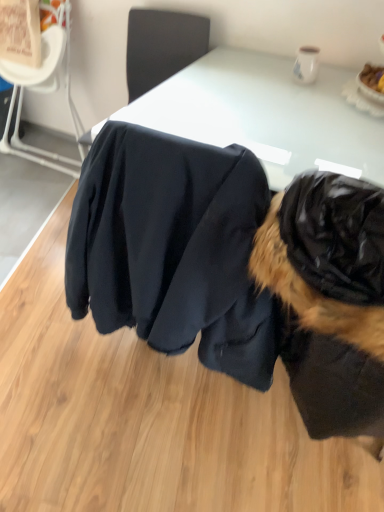
Image resolution: width=384 pixels, height=512 pixels. Describe the element at coordinates (329, 298) in the screenshot. I see `black fur coat at right` at that location.

Image resolution: width=384 pixels, height=512 pixels. What do you see at coordinates (161, 46) in the screenshot? I see `black fabric chair at upper center, marked as the 1th chair in a right-to-left arrangement` at bounding box center [161, 46].

You are a GUI agent. You are given a task and a screenshot of the screen. Output one action in this format:
    pyautogui.click(x=<x>, y=<y>)
    Task: Click on the black fabric chair at upper left, the 1th chair from the left
    The image size is (384, 512).
    Given the screenshot: What is the action you would take?
    pyautogui.click(x=43, y=91)

In order to face white glossy table at center, should I rotate leftwards or rightwards?

A 9.609 degree turn to the right will do.

Find the location of a particular element. This screenshot has width=384, height=512. black fur coat at right is located at coordinates (329, 298).

Which object is positioned more to the right, black fabric chair at upper left, the 1th chair from the left, or white glossy table at center?

A: From the viewer's perspective, white glossy table at center appears more on the right side.

From the image's perspective, which is below, black fabric chair at upper left, the 1th chair from the left, or white glossy table at center?

From the image's view, white glossy table at center is below.

How different are the orientations of black fabric chair at upper left, the second chair when ordered from right to left, and white glossy table at center in degrees?

3.89e-05 degrees separate the facing orientations of black fabric chair at upper left, the second chair when ordered from right to left, and white glossy table at center.

Is black fabric chair at upper left, the second chair when ordered from right to left, aimed at matte black jacket at center?

No, black fabric chair at upper left, the second chair when ordered from right to left, is not oriented towards matte black jacket at center.

Considering the relative sizes of black fabric chair at upper left, the 1th chair from the left, and matte black jacket at center in the image provided, is black fabric chair at upper left, the 1th chair from the left, smaller than matte black jacket at center?

No.

From the image's perspective, is black fabric chair at upper left, the second chair when ordered from right to left, above or below matte black jacket at center?

black fabric chair at upper left, the second chair when ordered from right to left, is situated higher than matte black jacket at center in the image.

Looking at this image, between black fabric chair at upper left, the 1th chair from the left, and matte black jacket at center, which one appears on the left side from the viewer's perspective?

black fabric chair at upper left, the 1th chair from the left, is more to the left.

Looking at this image, between white glossy table at center and black fur coat at right, which one has larger size?

Bigger between the two is white glossy table at center.

Considering the sizes of objects white glossy table at center and black fur coat at right in the image provided, who is wider, white glossy table at center or black fur coat at right?

With larger width is white glossy table at center.

Can you see white glossy table at center touching black fur coat at right?

No, white glossy table at center is not beside black fur coat at right.

Can you confirm if white glossy table at center is taller than black fur coat at right?

No.

Can you tell me how much matte black jacket at center and black fur coat at right differ in facing direction?

5.17e-05 degrees separate the facing orientations of matte black jacket at center and black fur coat at right.

Is matte black jacket at center aimed at black fur coat at right?

No.

Is matte black jacket at center shorter than black fur coat at right?

Yes.

Find the location of a particular element. The width and height of the screenshot is (384, 512). dog above the matte black jacket at center (from a real-world perspective) is located at coordinates tap(329, 298).

From a real-world perspective, is matte black jacket at center below black fabric chair at upper left, the second chair when ordered from right to left?

Indeed, from a real-world perspective, matte black jacket at center is positioned beneath black fabric chair at upper left, the second chair when ordered from right to left.

Who is shorter, matte black jacket at center or black fabric chair at upper left, the second chair when ordered from right to left?

With less height is matte black jacket at center.

Which is behind, point (146, 165) or point (53, 28)?

The point (53, 28) is farther from the camera.

Is matte black jacket at center far from black fabric chair at upper left, the second chair when ordered from right to left?

Absolutely, matte black jacket at center is distant from black fabric chair at upper left, the second chair when ordered from right to left.

Does black fabric chair at upper center, which is counted as the second chair, starting from the left, have a larger size compared to black fur coat at right?

Actually, black fabric chair at upper center, which is counted as the second chair, starting from the left, might be smaller than black fur coat at right.

Find the location of a particular element. This screenshot has height=512, width=384. dog below the black fabric chair at upper center, which is counted as the second chair, starting from the left (from the image's perspective) is located at coordinates (329, 298).

Do you think black fabric chair at upper center, which is counted as the second chair, starting from the left, is within black fur coat at right, or outside of it?

black fabric chair at upper center, which is counted as the second chair, starting from the left, is outside black fur coat at right.

Locate an element on the screen. the 1st chair to the left of the white glossy table at center, counting from the anchor's position is located at coordinates (161, 46).

Is black fabric chair at upper center, which is counted as the second chair, starting from the left, oriented away from white glossy table at center?

No, black fabric chair at upper center, which is counted as the second chair, starting from the left, is not facing the opposite direction of white glossy table at center.

Is black fabric chair at upper center, which is counted as the second chair, starting from the left, in contact with white glossy table at center?

No, black fabric chair at upper center, which is counted as the second chair, starting from the left, is not touching white glossy table at center.

From a real-world perspective, is black fabric chair at upper center, marked as the 1th chair in a right-to-left arrangement, physically located above or below white glossy table at center?

black fabric chair at upper center, marked as the 1th chair in a right-to-left arrangement, is above white glossy table at center.

You are a GUI agent. You are given a task and a screenshot of the screen. Output one action in this format:
    pyautogui.click(x=<x>, y=<y>)
    Task: Click on the table positioned vertically above the black fabric chair at upper left, the second chair when ordered from right to left (from a real-world perspective)
    
    Given the screenshot: What is the action you would take?
    pyautogui.click(x=265, y=115)

Locate an element on the screen. The image size is (384, 512). clothing beneath the black fabric chair at upper left, the 1th chair from the left (from a real-world perspective) is located at coordinates (173, 249).

When comparing their distances from black fur coat at right, does black fabric chair at upper center, marked as the 1th chair in a right-to-left arrangement, or matte black jacket at center seem further?

The object further to black fur coat at right is black fabric chair at upper center, marked as the 1th chair in a right-to-left arrangement.

Estimate the real-world distances between objects in this image. Which object is closer to white glossy table at center, matte black jacket at center or black fabric chair at upper center, marked as the 1th chair in a right-to-left arrangement?

Among the two, matte black jacket at center is located nearer to white glossy table at center.

Based on the photo, based on their spatial positions, is matte black jacket at center or black fabric chair at upper left, the 1th chair from the left, further from black fabric chair at upper center, marked as the 1th chair in a right-to-left arrangement?

matte black jacket at center is positioned further to the anchor black fabric chair at upper center, marked as the 1th chair in a right-to-left arrangement.

Estimate the real-world distances between objects in this image. Which object is further from black fabric chair at upper center, which is counted as the second chair, starting from the left, black fabric chair at upper left, the second chair when ordered from right to left, or matte black jacket at center?

matte black jacket at center is further to black fabric chair at upper center, which is counted as the second chair, starting from the left.

In the scene shown: Estimate the real-world distances between objects in this image. Which object is closer to matte black jacket at center, black fur coat at right or white glossy table at center?

black fur coat at right is positioned closer to the anchor matte black jacket at center.

When comparing their distances from black fabric chair at upper left, the 1th chair from the left, does white glossy table at center or black fabric chair at upper center, marked as the 1th chair in a right-to-left arrangement, seem further?

white glossy table at center.

Based on the photo, based on their spatial positions, is black fabric chair at upper center, which is counted as the second chair, starting from the left, or black fabric chair at upper left, the 1th chair from the left, further from black fur coat at right?

Among the two, black fabric chair at upper left, the 1th chair from the left, is located further to black fur coat at right.

Looking at the image, which one is located closer to black fabric chair at upper center, marked as the 1th chair in a right-to-left arrangement, black fur coat at right or white glossy table at center?

Among the two, white glossy table at center is located nearer to black fabric chair at upper center, marked as the 1th chair in a right-to-left arrangement.

The width and height of the screenshot is (384, 512). Identify the location of chair situated between black fabric chair at upper left, the second chair when ordered from right to left, and matte black jacket at center from left to right. [161, 46].

The height and width of the screenshot is (512, 384). In order to click on table between black fabric chair at upper center, marked as the 1th chair in a right-to-left arrangement, and matte black jacket at center vertically in this screenshot , I will do `click(265, 115)`.

Where is `table between matte black jacket at center and black fur coat at right from left to right`? This screenshot has width=384, height=512. table between matte black jacket at center and black fur coat at right from left to right is located at coordinates (265, 115).

Where is `table between black fabric chair at upper center, marked as the 1th chair in a right-to-left arrangement, and black fur coat at right from top to bottom`? This screenshot has height=512, width=384. table between black fabric chair at upper center, marked as the 1th chair in a right-to-left arrangement, and black fur coat at right from top to bottom is located at coordinates (265, 115).